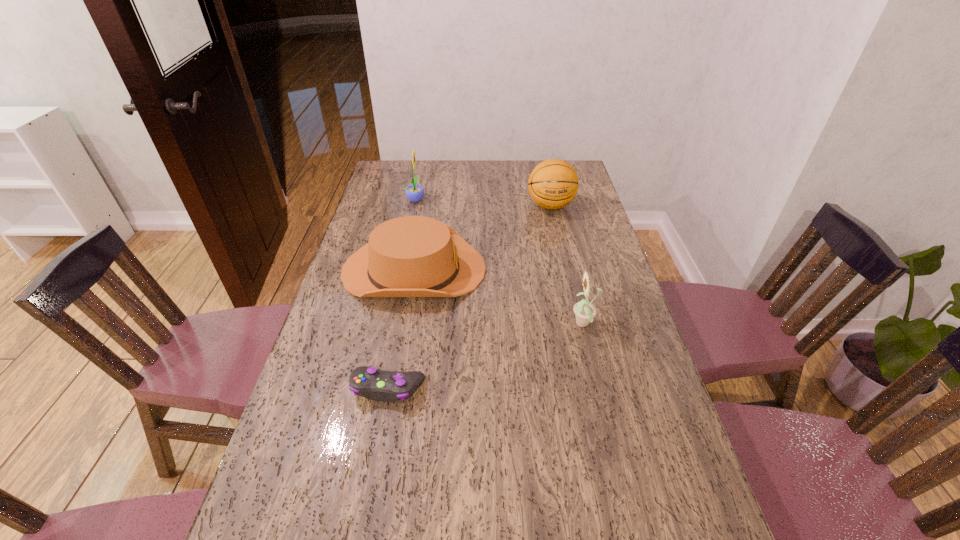
Find the location of a particular element. The width and height of the screenshot is (960, 540). free space located on the front-facing side of the nearer sunflower is located at coordinates (499, 325).

Find the location of a particular element. vacant space located on the front-facing side of the nearer sunflower is located at coordinates (443, 325).

Locate an element on the screen. The height and width of the screenshot is (540, 960). free space located on the front-facing side of the nearer sunflower is located at coordinates point(492,325).

Where is `free spot located on the front-facing side of the third nearest object`? The width and height of the screenshot is (960, 540). free spot located on the front-facing side of the third nearest object is located at coordinates (592, 269).

This screenshot has width=960, height=540. Identify the location of vacant space located on the right of the control. coord(516,388).

This screenshot has height=540, width=960. I want to click on sunflower that is at the left edge, so click(x=414, y=192).

This screenshot has height=540, width=960. Find the location of `cowboy hat that is at the left edge`. cowboy hat that is at the left edge is located at coordinates (412, 256).

This screenshot has width=960, height=540. What are the coordinates of `control at the left edge` in the screenshot? It's located at (387, 386).

What are the coordinates of `basketball located in the right edge section of the desktop` in the screenshot? It's located at (553, 184).

Image resolution: width=960 pixels, height=540 pixels. In order to click on sunflower that is at the right edge in this screenshot , I will do `click(584, 311)`.